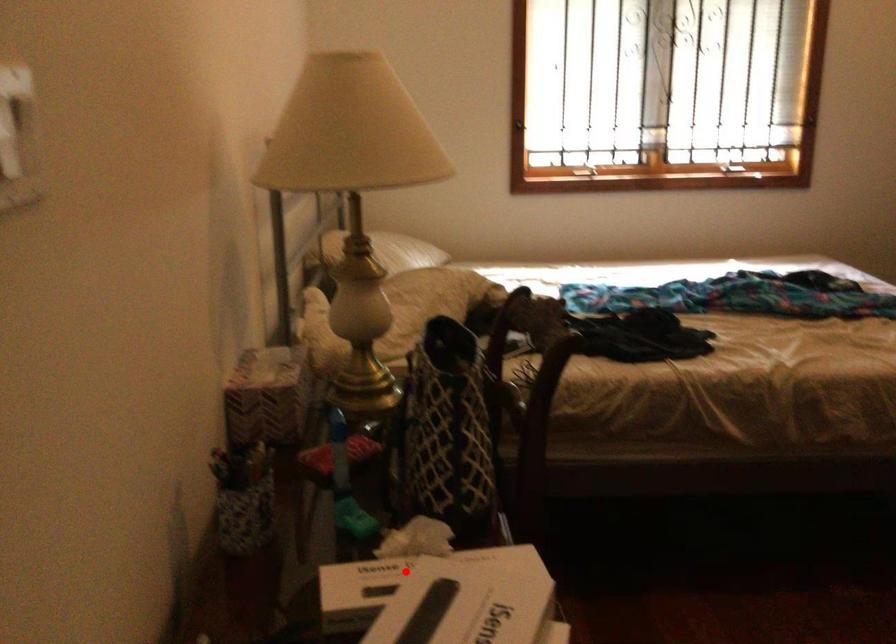
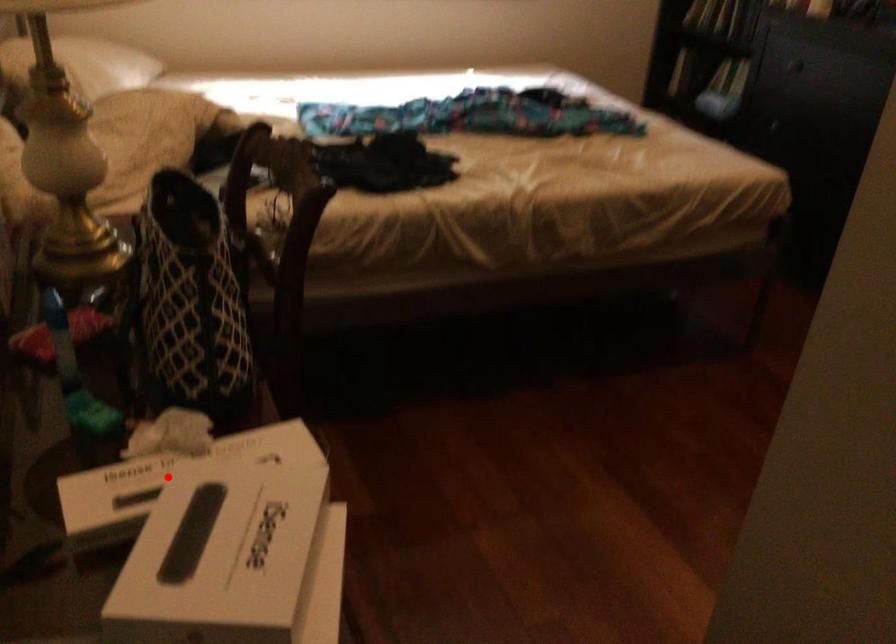
I am providing you with two images of the same scene from different viewpoints. A red point is marked on the first image and another point is marked on the second image. Is the red point in image1 aligned with the point shown in image2?

Yes